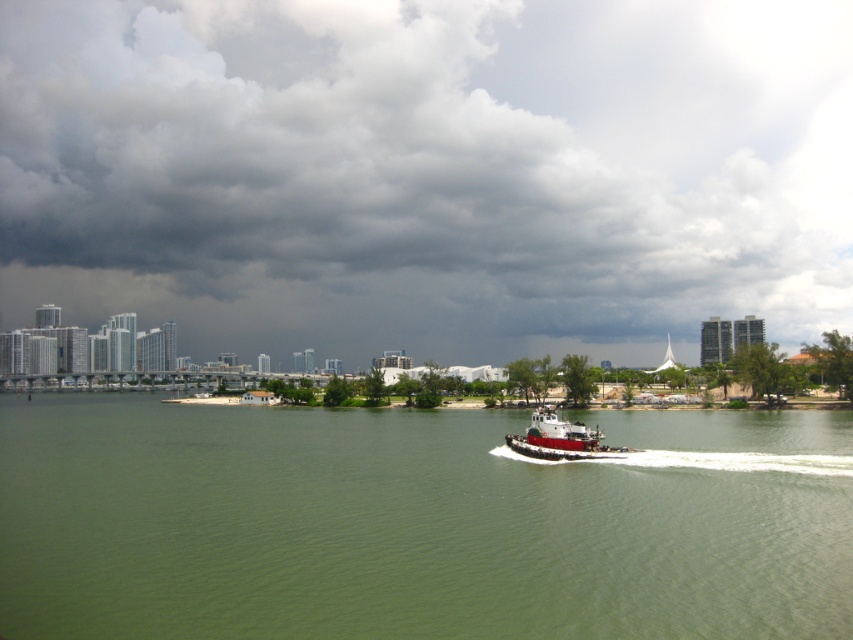
Question: Does green water at center have a smaller size compared to white rubber boat at center?

Choices:
 (A) yes
 (B) no

Answer: (B)

Question: Can you confirm if dark gray cloud at upper center is bigger than green water at center?

Choices:
 (A) no
 (B) yes

Answer: (B)

Question: Is dark gray cloud at upper center wider than green water at center?

Choices:
 (A) no
 (B) yes

Answer: (B)

Question: Which of the following is the closest to the observer?

Choices:
 (A) dark gray cloud at upper center
 (B) white rubber boat at center
 (C) green water at center

Answer: (C)

Question: Which object is positioned farthest from the dark gray cloud at upper center?

Choices:
 (A) white rubber boat at center
 (B) green water at center

Answer: (A)

Question: Among these objects, which one is nearest to the camera?

Choices:
 (A) dark gray cloud at upper center
 (B) white rubber boat at center

Answer: (B)